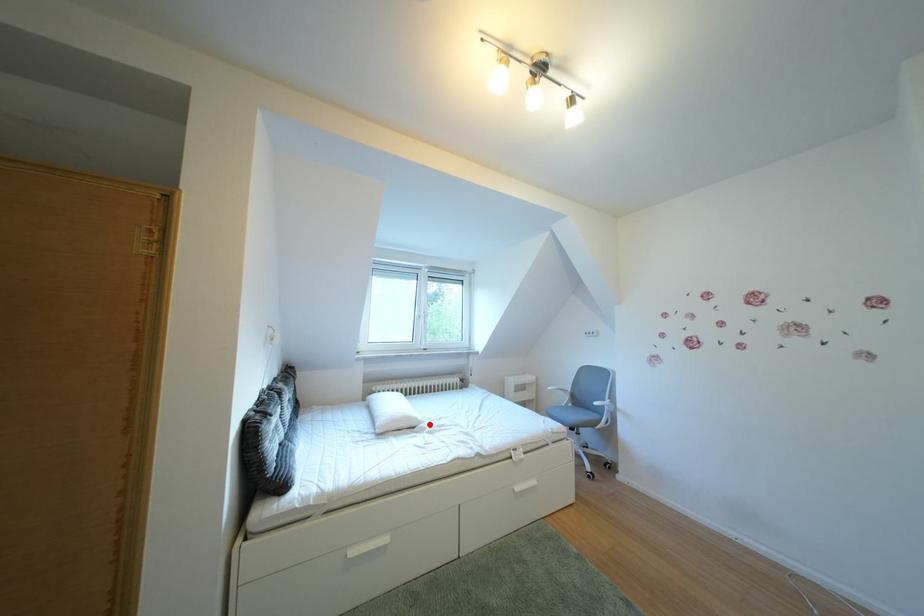
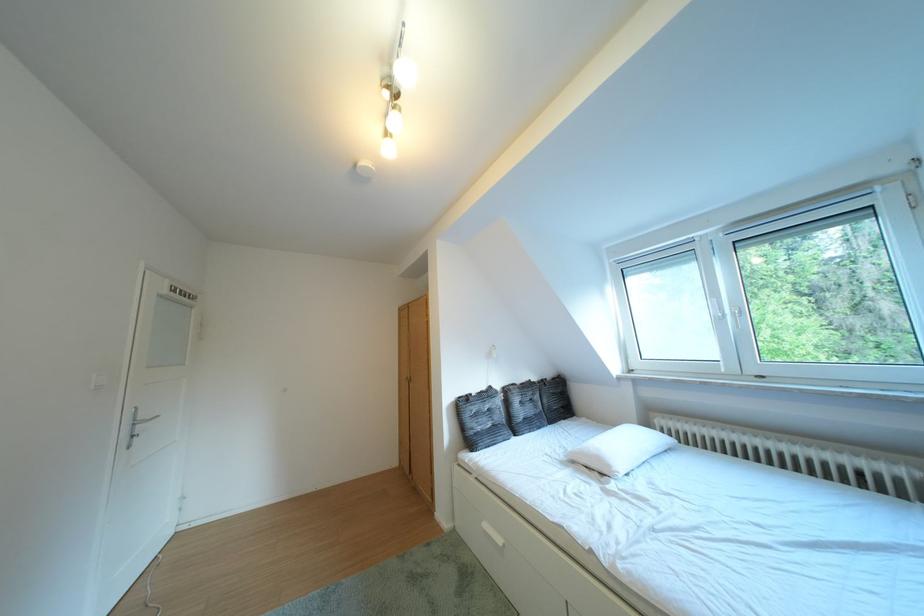
Question: I am providing you with two images of the same scene from different viewpoints. Image1 has a red point marked. In image2, the corresponding 3D location appears at what relative position? Reply with the corresponding letter.

Choices:
 (A) Closer
 (B) Farther

Answer: (B)